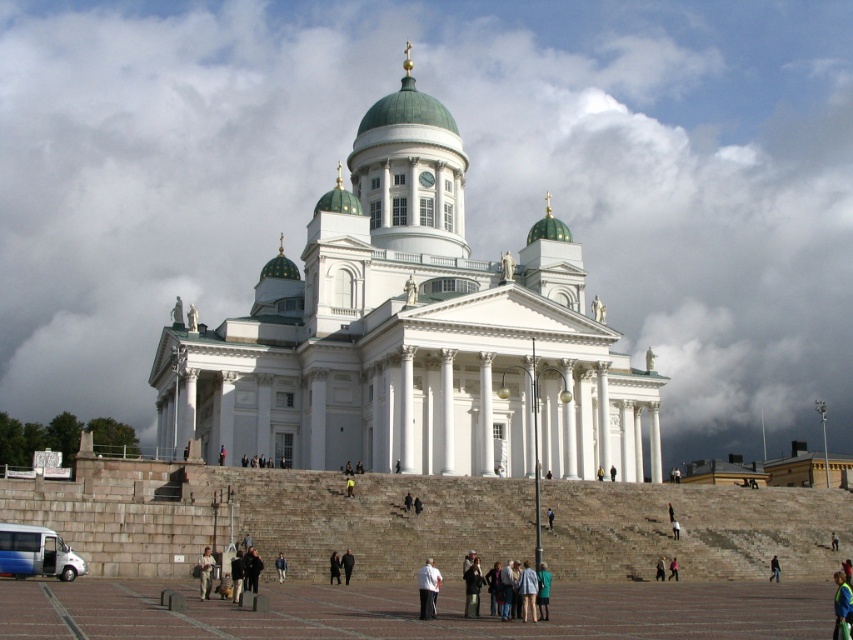
Question: Which point is farther to the camera?

Choices:
 (A) dark blue jeans at lower center
 (B) dark blue jacket at center
 (C) yellow-green jacket at center

Answer: (A)

Question: Does dark blue jacket at center have a larger size compared to dark brown leather jacket at center?

Choices:
 (A) no
 (B) yes

Answer: (B)

Question: Does dark brown leather jacket at center appear over dark gray jacket at center?

Choices:
 (A) yes
 (B) no

Answer: (A)

Question: Which of the following is the farthest from the observer?

Choices:
 (A) (332, 573)
 (B) (347, 579)

Answer: (A)

Question: Does dark clothing at center lie in front of dark blue jeans at lower center?

Choices:
 (A) no
 (B) yes

Answer: (A)

Question: Which object appears closest to the camera in this image?

Choices:
 (A) dark blue jeans at center
 (B) pink fabric at center

Answer: (B)